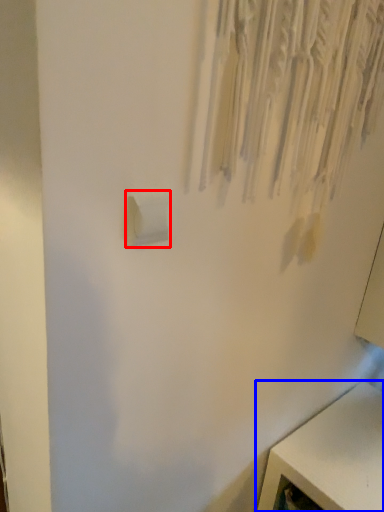
Question: Which point is closer to the camera, light switch (highlighted by a red box) or furniture (highlighted by a blue box)?

Choices:
 (A) light switch
 (B) furniture

Answer: (A)